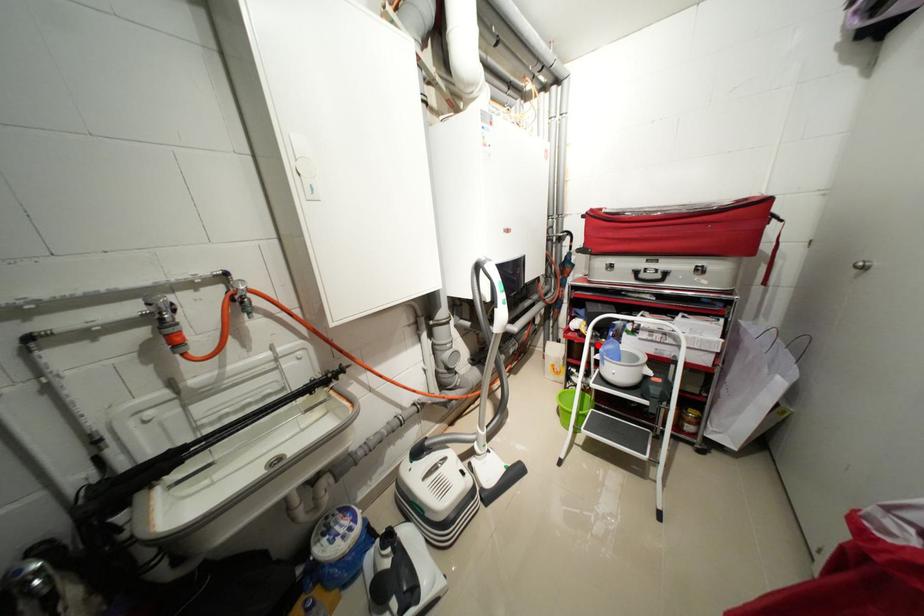
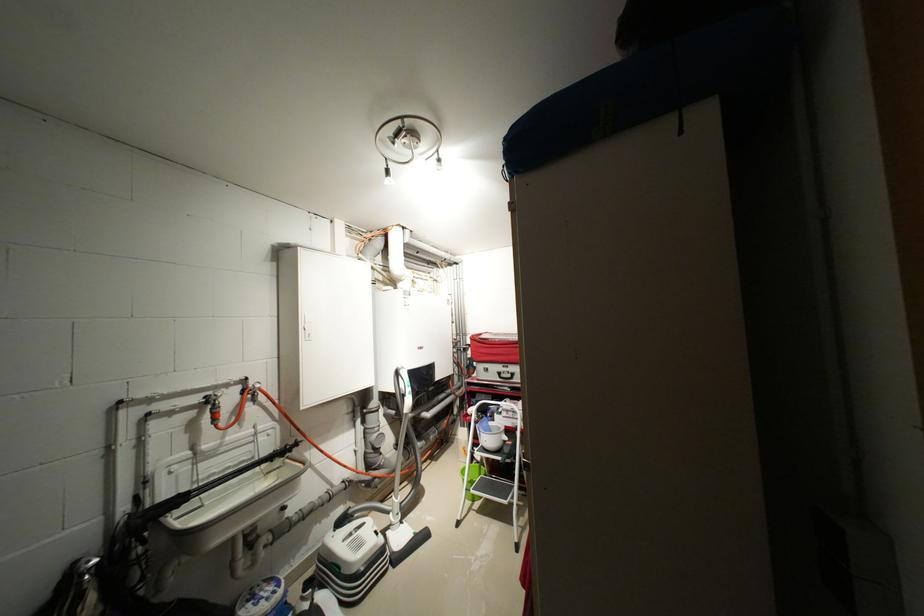
Find the pixel in the second image that matches the highlighted location in the first image.

(482, 424)